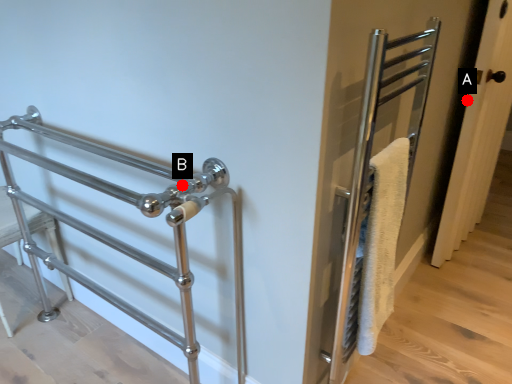
Question: Two points are circled on the image, labeled by A and B beside each circle. Which point is further to the camera?

Choices:
 (A) A is further
 (B) B is further

Answer: (A)